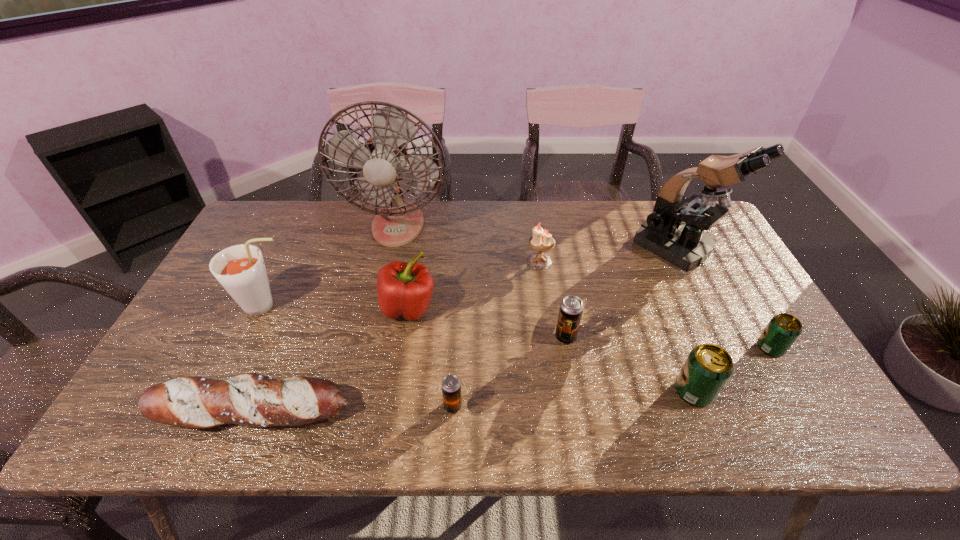
This screenshot has width=960, height=540. Find the location of `fan`. fan is located at coordinates (384, 156).

Find the location of a particular element. Image resolution: width=960 pixels, height=540 pixels. microscope is located at coordinates (674, 230).

Image resolution: width=960 pixels, height=540 pixels. Identify the location of root beer. click(240, 269).

The width and height of the screenshot is (960, 540). Identify the location of candle holder. (541, 241).

Identify the location of bell pepper. This screenshot has width=960, height=540. (404, 290).

Find the location of `the left green beer can`. the left green beer can is located at coordinates (708, 367).

Find the location of `the bigger green beer can`. the bigger green beer can is located at coordinates (708, 367).

Locate an element on the screen. This screenshot has height=540, width=960. the bigger black beer can is located at coordinates (571, 308).

Where is `the second beer can from left to right`? the second beer can from left to right is located at coordinates (571, 308).

I want to click on the rightmost beer can, so click(783, 329).